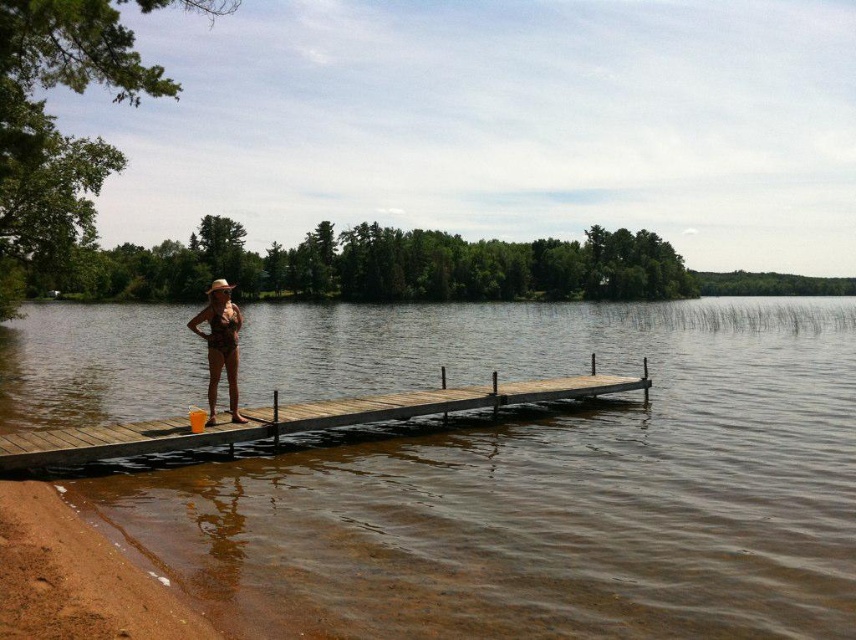
Question: Which object appears closest to the camera in this image?

Choices:
 (A) wooden dock at center
 (B) matte brown bikini at center
 (C) brown wooden dock at center

Answer: (C)

Question: Does brown wooden dock at center have a larger size compared to wooden dock at center?

Choices:
 (A) no
 (B) yes

Answer: (B)

Question: Which object is positioned closest to the brown wooden dock at center?

Choices:
 (A) wooden dock at center
 (B) matte brown bikini at center

Answer: (A)

Question: Among these points, which one is nearest to the camera?

Choices:
 (A) (223, 356)
 (B) (471, 396)

Answer: (A)

Question: Can you confirm if brown wooden dock at center is smaller than wooden dock at center?

Choices:
 (A) no
 (B) yes

Answer: (A)

Question: Is brown wooden dock at center closer to camera compared to matte brown bikini at center?

Choices:
 (A) yes
 (B) no

Answer: (A)